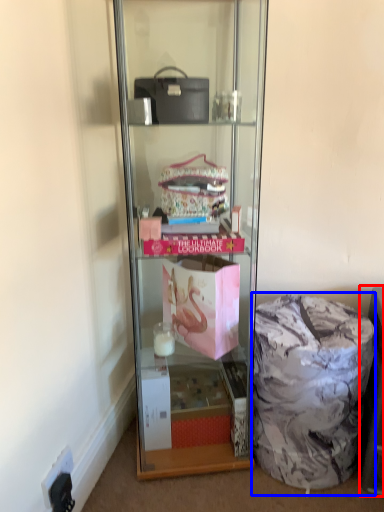
Question: Which of the following is the closest to the observer, cabinet (highlighted by a red box) or garbage (highlighted by a blue box)?

Choices:
 (A) cabinet
 (B) garbage

Answer: (A)